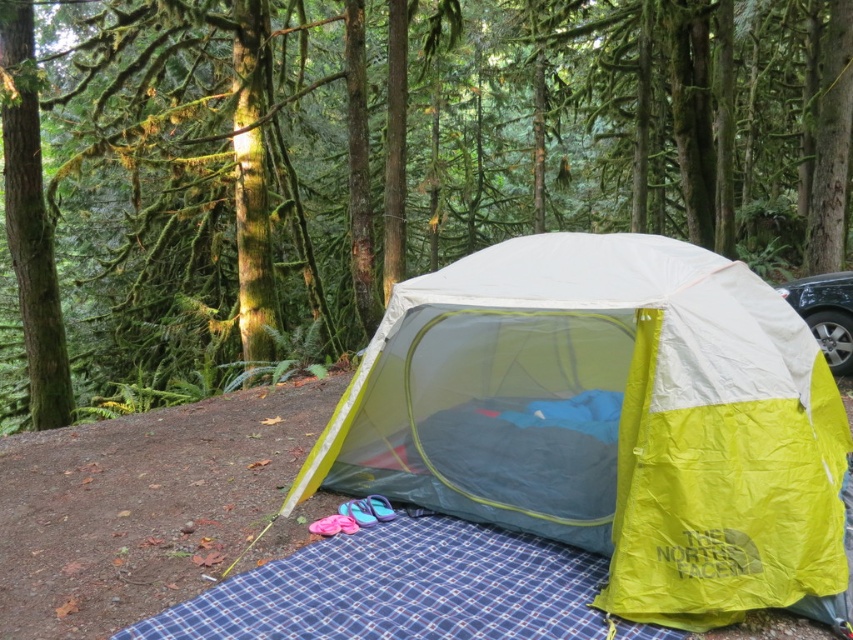
Question: Does yellow fabric tent at center appear on the right side of metallic gray car at right?

Choices:
 (A) yes
 (B) no

Answer: (B)

Question: Based on their relative distances, which object is farther from the yellow fabric tent at center?

Choices:
 (A) metallic gray car at right
 (B) green mossy bark tree at upper left

Answer: (B)

Question: Observing the image, what is the correct spatial positioning of yellow fabric tent at center in reference to green mossy bark tree at upper left?

Choices:
 (A) below
 (B) above

Answer: (A)

Question: Considering the real-world distances, which object is closest to the green mossy bark tree at upper left?

Choices:
 (A) metallic gray car at right
 (B) yellow fabric tent at center
 (C) green mossy tree at center

Answer: (B)

Question: Is green mossy tree at center above yellow fabric tent at center?

Choices:
 (A) yes
 (B) no

Answer: (A)

Question: Which point is farther from the camera taking this photo?

Choices:
 (A) (753, 134)
 (B) (390, 413)
 (C) (47, 296)
 (D) (815, 307)

Answer: (A)